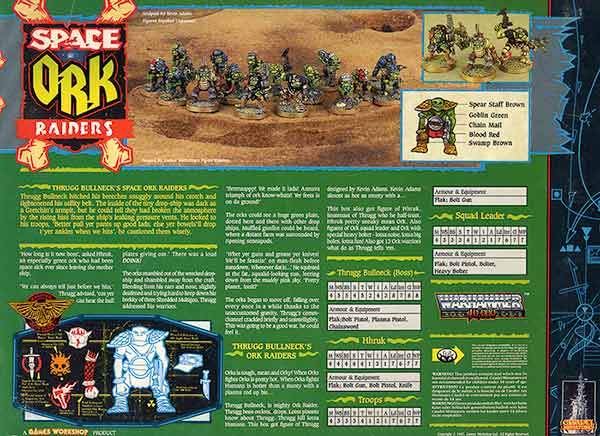
Locate an element on the screen. column 2 is located at coordinates point(171,261).